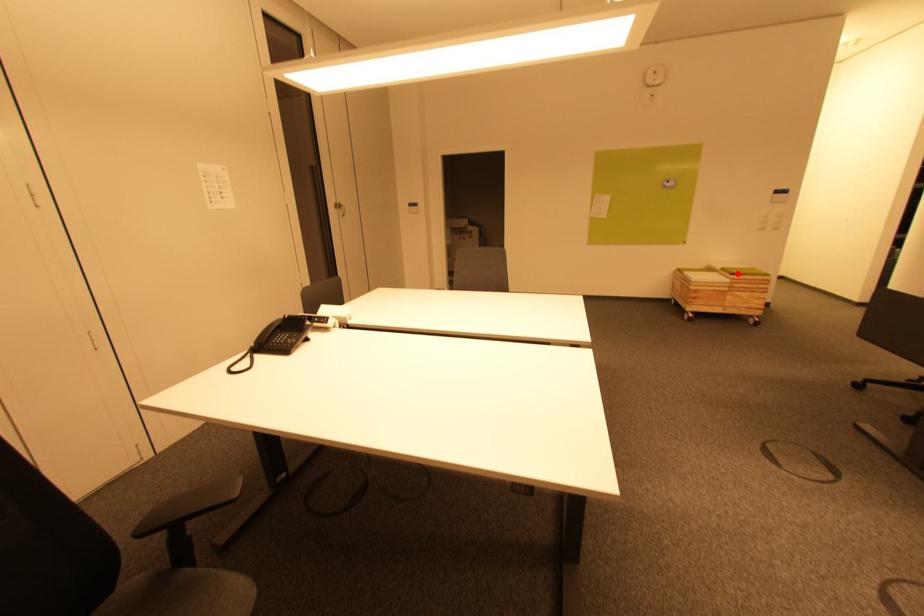
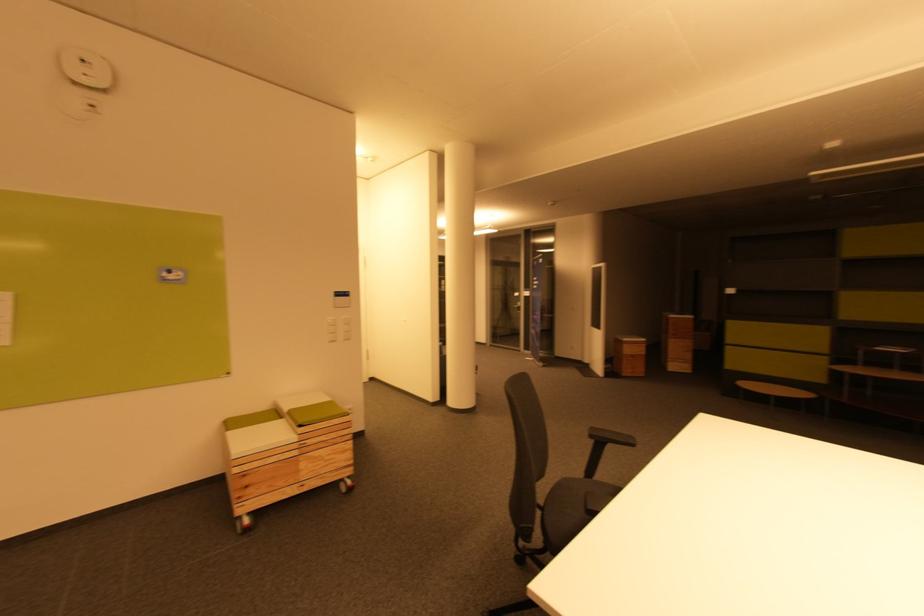
The point at the highlighted location is marked in the first image. Where is the corresponding point in the second image?

(305, 424)